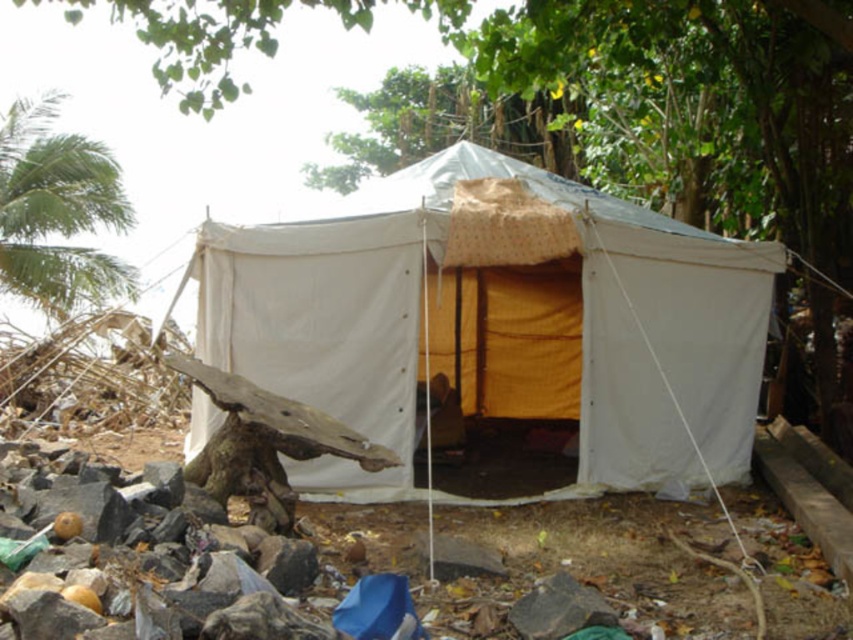
Is white canvas tent at center smaller than green leafy tree at left?

Yes.

Does point (500, 344) come behind point (0, 218)?

That is False.

Identify the location of white canvas tent at center. (498, 323).

Is green leafy tree at upper center further to the viewer compared to green leafy tree at left?

No, green leafy tree at upper center is in front of green leafy tree at left.

Between green leafy tree at upper center and green leafy tree at left, which one appears on the left side from the viewer's perspective?

Positioned to the left is green leafy tree at left.

Which is behind, point (193, 38) or point (55, 204)?

Positioned behind is point (55, 204).

What are the coordinates of `green leafy tree at upper center` in the screenshot? It's located at (231, 35).

Can you confirm if white canvas tent at center is positioned below green leafy tree at upper center?

Correct, white canvas tent at center is located below green leafy tree at upper center.

Does white canvas tent at center have a lesser height compared to green leafy tree at upper center?

Correct, white canvas tent at center is not as tall as green leafy tree at upper center.

Image resolution: width=853 pixels, height=640 pixels. Identify the location of white canvas tent at center. (498, 323).

The height and width of the screenshot is (640, 853). I want to click on white canvas tent at center, so click(498, 323).